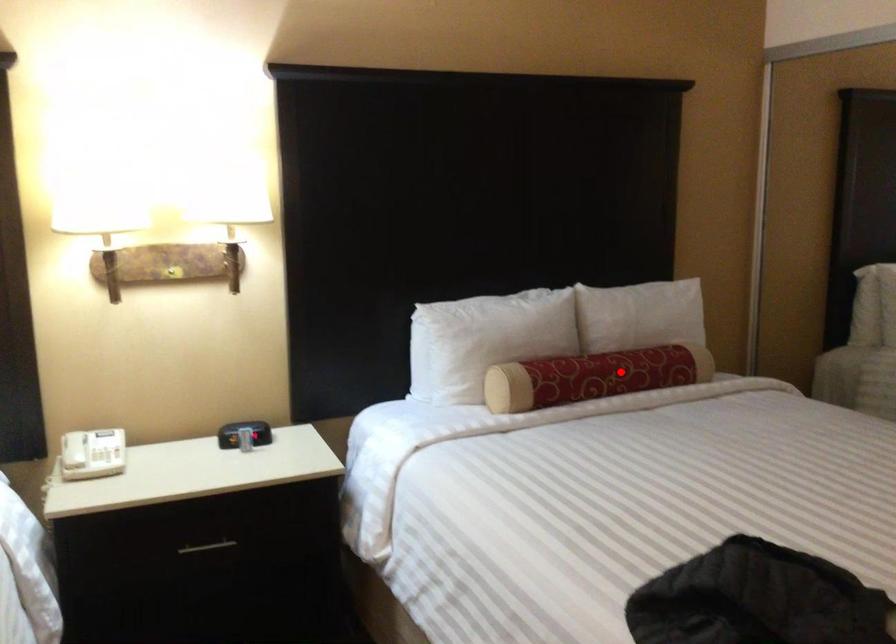
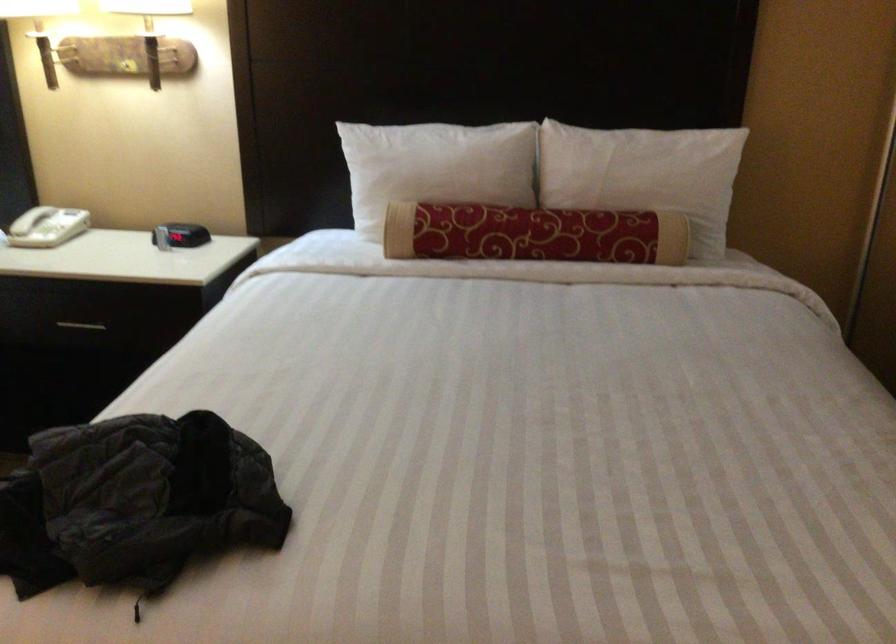
The point at the highlighted location is marked in the first image. Where is the corresponding point in the second image?

(533, 234)